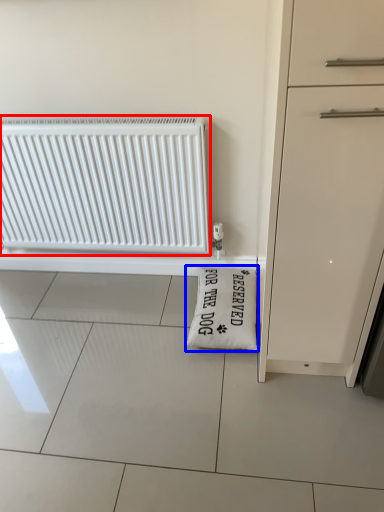
Question: Among these objects, which one is farthest to the camera, radiator (highlighted by a red box) or doormat (highlighted by a blue box)?

Choices:
 (A) radiator
 (B) doormat

Answer: (B)